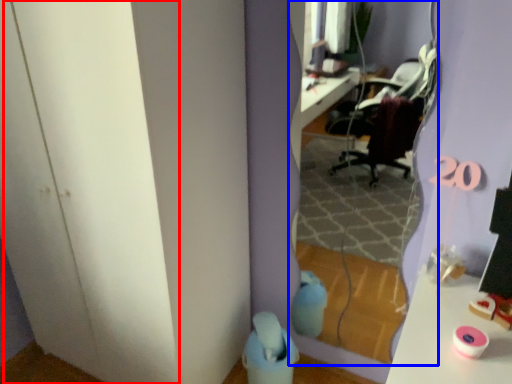
Question: Which object appears closest to the camera in this image, glass door (highlighted by a red box) or mirror (highlighted by a blue box)?

Choices:
 (A) glass door
 (B) mirror

Answer: (A)